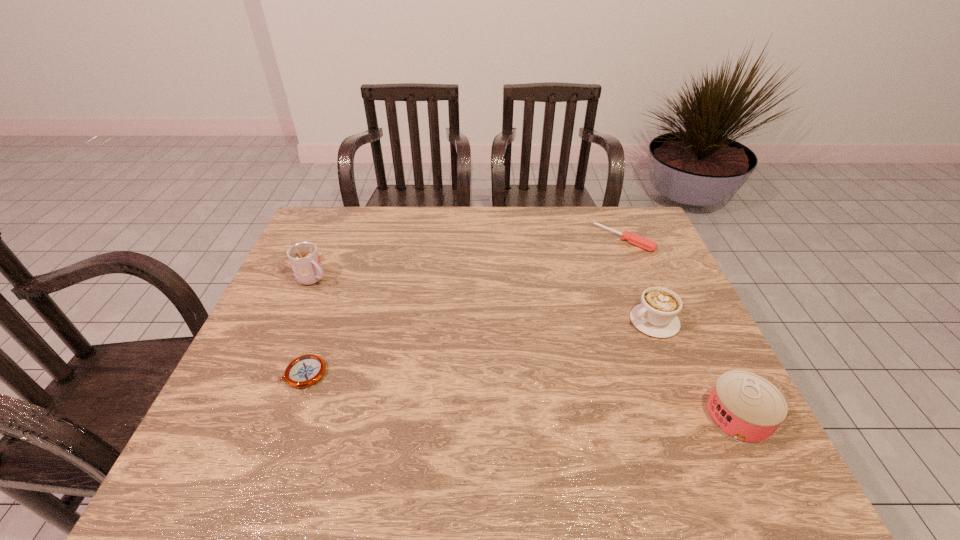
The width and height of the screenshot is (960, 540). Find the location of `vacant space on the desktop that is between the fourth farthest object and the nearest object and is positioned to the right of the cappuccino's handle`. vacant space on the desktop that is between the fourth farthest object and the nearest object and is positioned to the right of the cappuccino's handle is located at coordinates (499, 393).

Where is `vacant space on the desktop that is between the second nearest object and the nearest object and is positioned at the tip of the farthest object`? This screenshot has width=960, height=540. vacant space on the desktop that is between the second nearest object and the nearest object and is positioned at the tip of the farthest object is located at coordinates (468, 389).

Locate an element on the screen. The image size is (960, 540). free space on the desktop that is between the compass and the can and is positioned on the side with the handle of the tallest object is located at coordinates (481, 390).